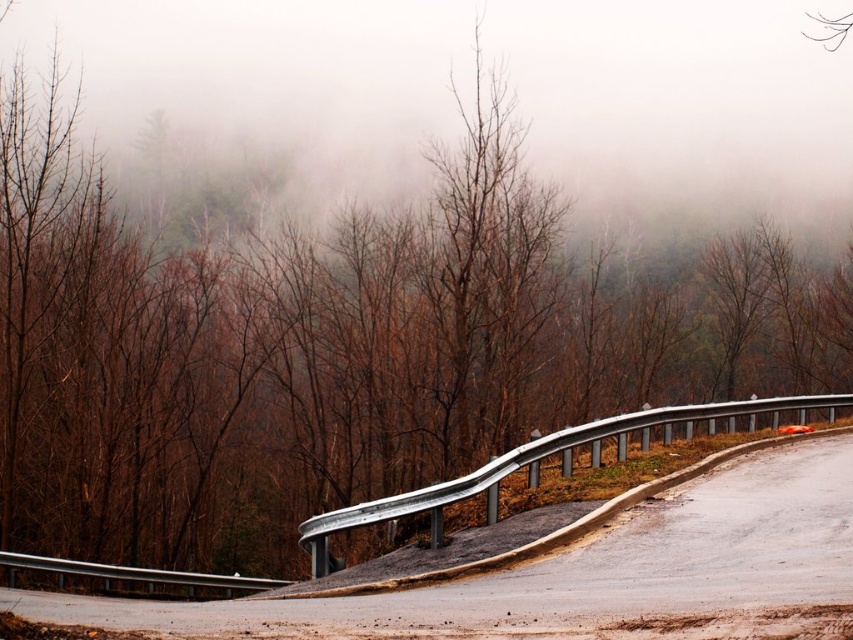
You are driving a car and see the silver metallic guardrail at center and the silver metallic guardrail at lower left ahead on the road. Which guardrail will you encounter first as you continue driving forward?

The silver metallic guardrail at center is in front of the silver metallic guardrail at lower left, so you will encounter the silver metallic guardrail at center first.

You are driving a car and need to stay on the road. You see the silver metallic guardrail at center and the silver metallic guardrail at lower left. Which guardrail should you steer towards to stay on the road?

You should steer towards the silver metallic guardrail at center because it has a larger size compared to the silver metallic guardrail at lower left, indicating it is closer and part of the road you are on.

You are driving along the curving road and need to stay within the guardrail area. Based on the coordinates provided, is the silver metallic guardrail at center positioned to the left or right of the road?

The silver metallic guardrail at center is located at point coordinates that place it along the central part of the road, acting as a divider or boundary. Since the road curves and the guardrail follows its edge, it is positioned along the outer edge of the curve, typically the right side if driving in a country with left hand traffic or left side if in right hand traffic. However, without knowing the driving direction, the guardrail is centrally aligned with the road curve, so it is positioned at the curve